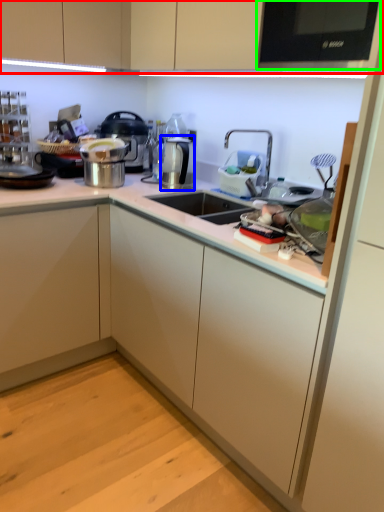
Question: Estimate the real-world distances between objects in this image. Which object is closer to cabinetry (highlighted by a red box), appliance (highlighted by a blue box) or home appliance (highlighted by a green box)?

Choices:
 (A) appliance
 (B) home appliance

Answer: (B)